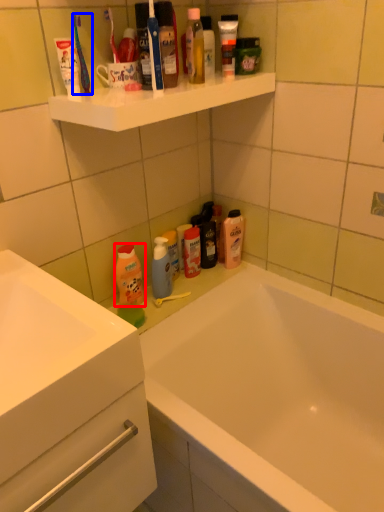
Question: Which of the following is the farthest to the observer, cleaning product (highlighted by a red box) or toothbrush (highlighted by a blue box)?

Choices:
 (A) cleaning product
 (B) toothbrush

Answer: (A)